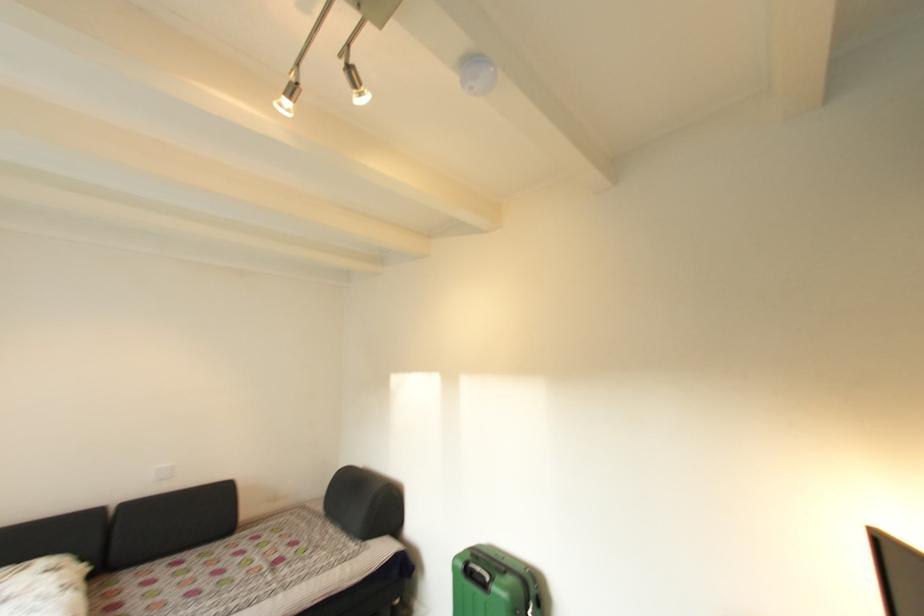
Describe the element at coordinates (324, 581) in the screenshot. I see `the sofa sitting surface` at that location.